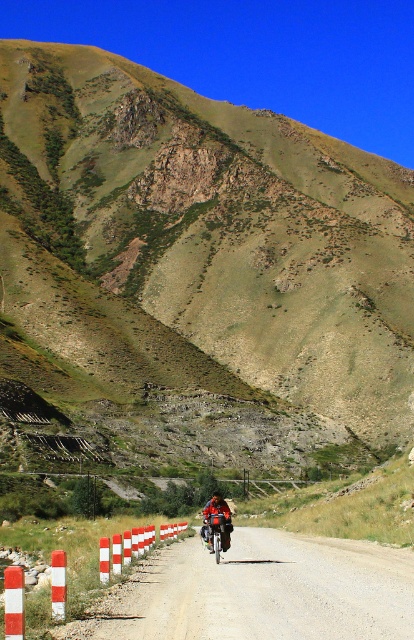
Question: Considering the real-world distances, which object is farthest from the smooth asphalt road at center?

Choices:
 (A) orange leather jacket at center
 (B) green grassy hillside at upper center

Answer: (B)

Question: Which of the following is the closest to the observer?

Choices:
 (A) (219, 493)
 (B) (115, 618)
 (C) (308, 612)

Answer: (C)

Question: Observing the image, what is the correct spatial positioning of smooth asphalt road at center in reference to red and white striped barrier at lower left?

Choices:
 (A) right
 (B) left

Answer: (A)

Question: Which point is farther to the camera?

Choices:
 (A) (209, 529)
 (B) (12, 349)
 (C) (291, 561)
 (D) (31, 605)

Answer: (B)

Question: Does red and white striped barrier at lower left have a larger size compared to orange leather jacket at center?

Choices:
 (A) yes
 (B) no

Answer: (A)

Question: Does smooth asphalt road at center come in front of red and white striped barrier at lower left?

Choices:
 (A) yes
 (B) no

Answer: (A)